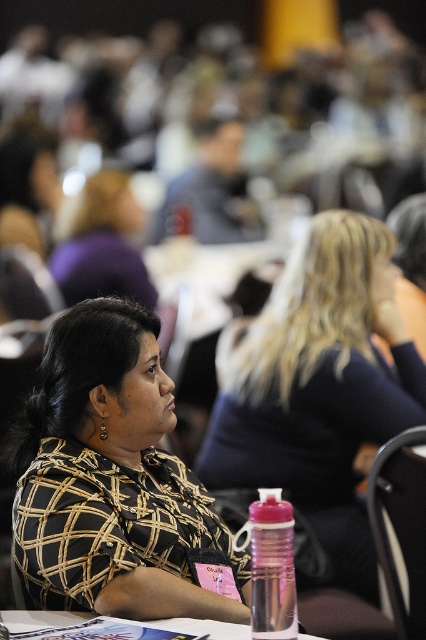
You are a GUI agent. You are given a task and a screenshot of the screen. Output one action in this format:
    pyautogui.click(x=<x>, y=<y>)
    Task: Click on the printed fabric shirt at center
    This screenshot has width=426, height=640.
    Given the screenshot: What is the action you would take?
    pyautogui.click(x=109, y=477)